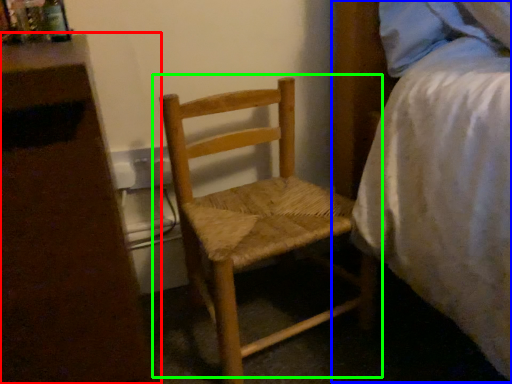
Question: Which object is positioned closest to nightstand (highlighted by a red box)? Select from bed (highlighted by a blue box) and chair (highlighted by a green box).

Choices:
 (A) bed
 (B) chair

Answer: (B)